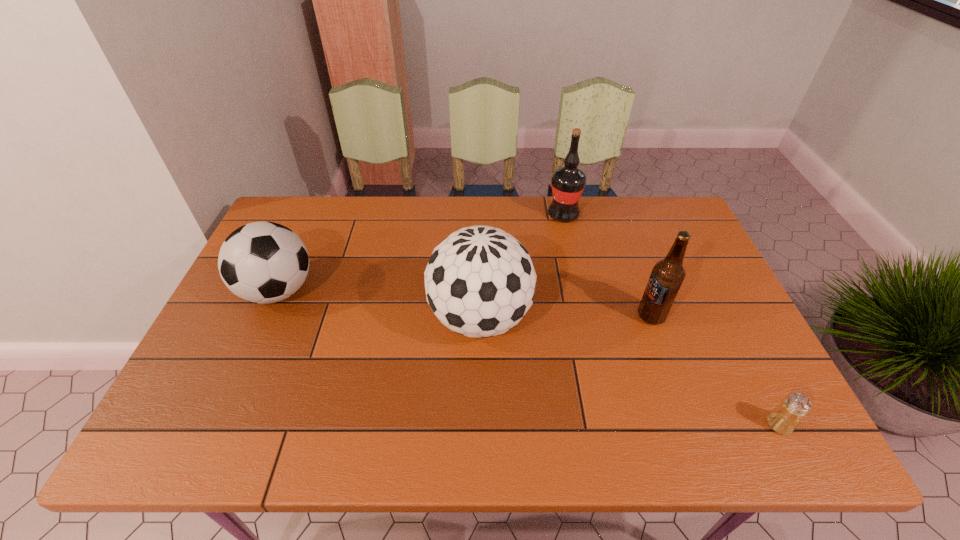
Locate an element on the screen. blank space that satisfies the following two spatial constraints: 1. on the front side of the leftmost object; 2. on the left side of the rightmost object is located at coordinates (219, 424).